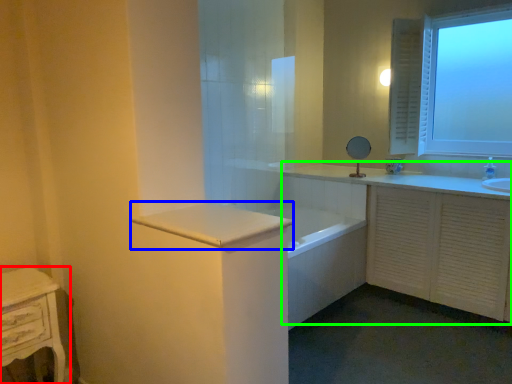
Question: Which object is the closest to the nightstand (highlighted by a red box)? Choose among these: counter top (highlighted by a blue box) or bathroom cabinet (highlighted by a green box).

Choices:
 (A) counter top
 (B) bathroom cabinet

Answer: (A)